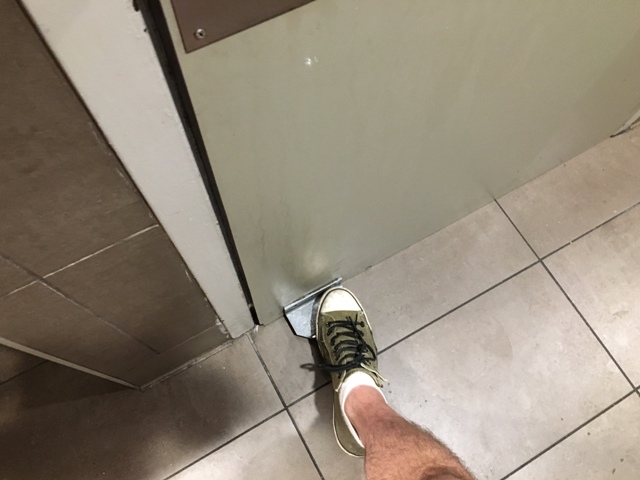
What are the coordinates of `floor` in the screenshot? It's located at (477, 406).